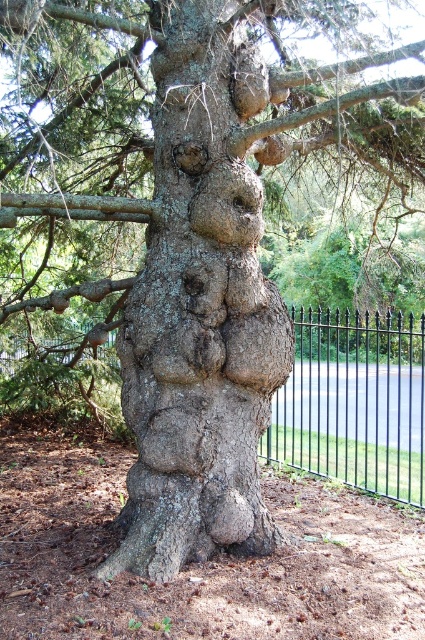
Who is taller, gray rough bark tree trunk at center or black wrought iron fence at center?

gray rough bark tree trunk at center is taller.

Does gray rough bark tree trunk at center appear over black wrought iron fence at center?

Yes.

Image resolution: width=425 pixels, height=640 pixels. I want to click on gray rough bark tree trunk at center, so click(x=200, y=310).